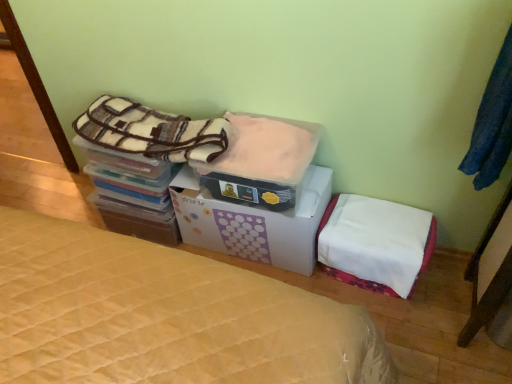
Question: Is white cardboard box at center at the right side of white fabric mattress at lower right?

Choices:
 (A) yes
 (B) no

Answer: (B)

Question: Is white fabric mattress at lower right inside white cardboard box at center?

Choices:
 (A) no
 (B) yes

Answer: (A)

Question: From the image's perspective, is white cardboard box at center above white fabric mattress at lower right?

Choices:
 (A) yes
 (B) no

Answer: (A)

Question: Can you confirm if white cardboard box at center is smaller than white fabric mattress at lower right?

Choices:
 (A) no
 (B) yes

Answer: (A)

Question: Is white cardboard box at center not within white fabric mattress at lower right?

Choices:
 (A) no
 (B) yes

Answer: (B)

Question: Is white cardboard box at center far from white fabric mattress at lower right?

Choices:
 (A) no
 (B) yes

Answer: (A)

Question: From a real-world perspective, is white cardboard box at center under fuzzy pink blanket at center, positioned as the first blanket in right-to-left order?

Choices:
 (A) no
 (B) yes

Answer: (B)

Question: Considering the relative positions of white cardboard box at center and fuzzy pink blanket at center, which is the 2th blanket from left to right, in the image provided, is white cardboard box at center to the right of fuzzy pink blanket at center, which is the 2th blanket from left to right, from the viewer's perspective?

Choices:
 (A) yes
 (B) no

Answer: (B)

Question: Is white cardboard box at center directly adjacent to fuzzy pink blanket at center, positioned as the first blanket in right-to-left order?

Choices:
 (A) yes
 (B) no

Answer: (B)

Question: From a real-world perspective, is white cardboard box at center physically above fuzzy pink blanket at center, positioned as the first blanket in right-to-left order?

Choices:
 (A) no
 (B) yes

Answer: (A)

Question: Is white cardboard box at center thinner than fuzzy pink blanket at center, which is the 2th blanket from left to right?

Choices:
 (A) no
 (B) yes

Answer: (A)

Question: Is white cardboard box at center facing towards fuzzy pink blanket at center, positioned as the first blanket in right-to-left order?

Choices:
 (A) no
 (B) yes

Answer: (A)

Question: Can you confirm if plush fleece blanket at upper left, which is counted as the first blanket, starting from the left, is thinner than fuzzy pink blanket at center, positioned as the first blanket in right-to-left order?

Choices:
 (A) no
 (B) yes

Answer: (B)